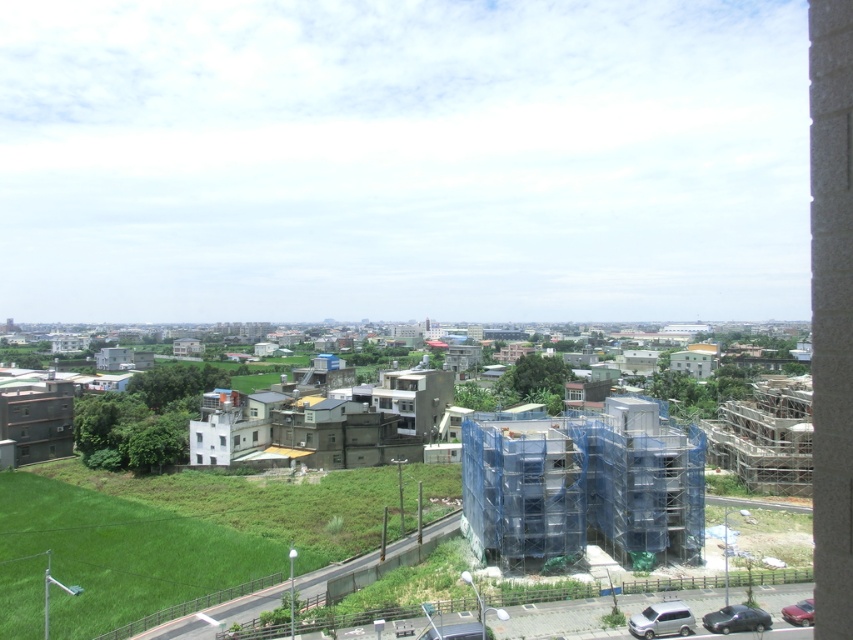
Can you confirm if blue mesh scaffolding at center is taller than concrete block wall at right?

No, blue mesh scaffolding at center is not taller than concrete block wall at right.

Which is more to the left, blue mesh scaffolding at center or concrete block wall at right?

From the viewer's perspective, blue mesh scaffolding at center appears more on the left side.

Identify the location of blue mesh scaffolding at center. (582, 484).

Locate an element on the screen. The image size is (853, 640). blue mesh scaffolding at center is located at coordinates (582, 484).

Can you confirm if concrete block wall at right is positioned above metallic silver car at lower right?

Yes, concrete block wall at right is above metallic silver car at lower right.

Locate an element on the screen. The width and height of the screenshot is (853, 640). concrete block wall at right is located at coordinates (831, 310).

Where is `concrete block wall at right`? The width and height of the screenshot is (853, 640). concrete block wall at right is located at coordinates point(831,310).

Is shiny black car at lower right to the right of metallic silver car at lower right from the viewer's perspective?

In fact, shiny black car at lower right is to the left of metallic silver car at lower right.

Between point (744, 612) and point (798, 600), which one is positioned behind?

Positioned behind is point (798, 600).

You are a GUI agent. You are given a task and a screenshot of the screen. Output one action in this format:
    pyautogui.click(x=<x>, y=<y>)
    Task: Click on the shiny black car at lower right
    The image size is (853, 640).
    Given the screenshot: What is the action you would take?
    pyautogui.click(x=735, y=620)